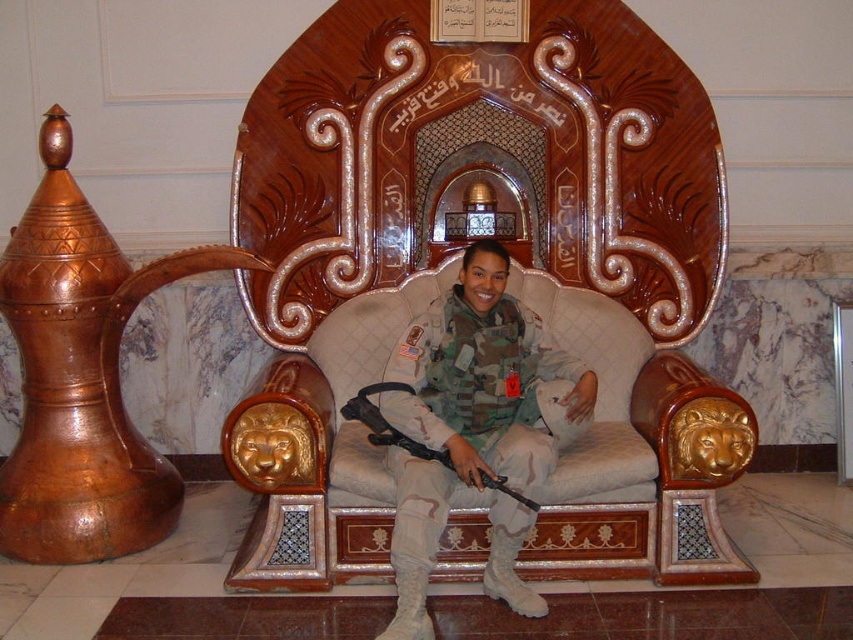
Is wooden throne at center bigger than camouflage uniform at center?

Correct, wooden throne at center is larger in size than camouflage uniform at center.

Who is lower down, wooden throne at center or camouflage uniform at center?

Positioned lower is camouflage uniform at center.

Who is more distant from viewer, [321,76] or [405,566]?

The point [321,76] is behind.

Locate an element on the screen. The height and width of the screenshot is (640, 853). wooden throne at center is located at coordinates (508, 285).